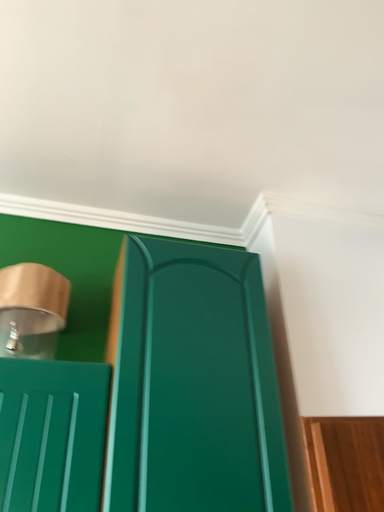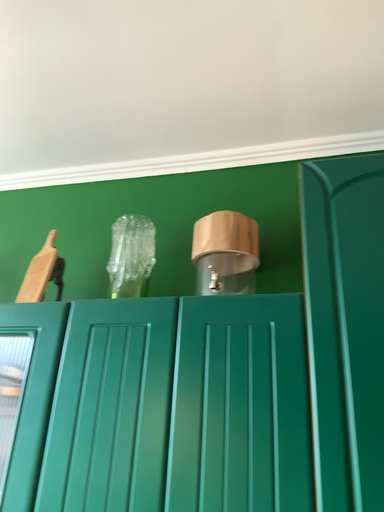
Question: How did the camera likely rotate when shooting the video?

Choices:
 (A) rotated left
 (B) rotated right

Answer: (A)